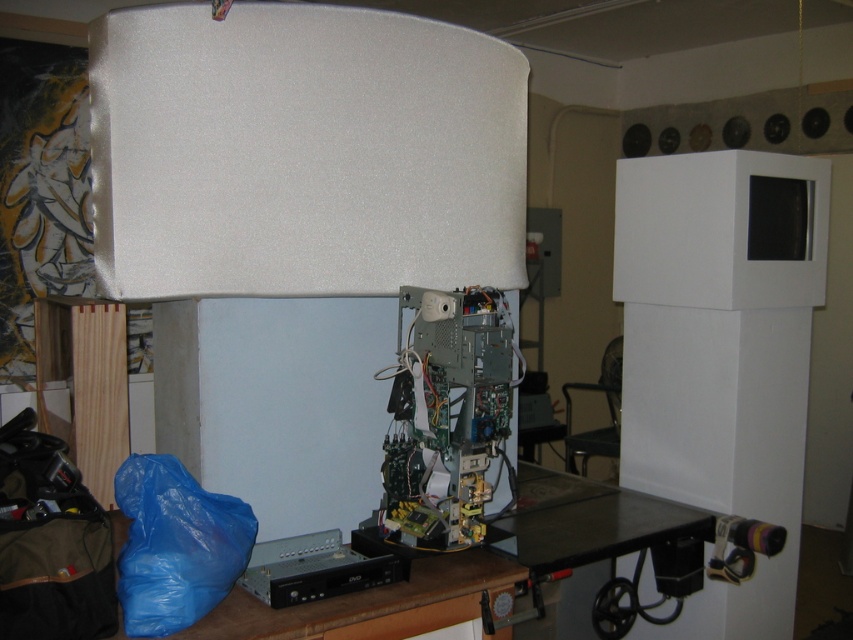
Question: Can you confirm if green circuit board at center is positioned to the left of metallic gray dvd player at lower center?

Choices:
 (A) no
 (B) yes

Answer: (A)

Question: From the image, what is the correct spatial relationship of green circuit board at center in relation to metallic gray dvd player at lower center?

Choices:
 (A) left
 (B) right

Answer: (B)

Question: Which point is farther to the camera?

Choices:
 (A) (312, 540)
 (B) (387, 529)

Answer: (B)

Question: Among these points, which one is farthest from the camera?

Choices:
 (A) (250, 584)
 (B) (450, 502)

Answer: (B)

Question: Is green circuit board at center bigger than metallic gray dvd player at lower center?

Choices:
 (A) yes
 (B) no

Answer: (A)